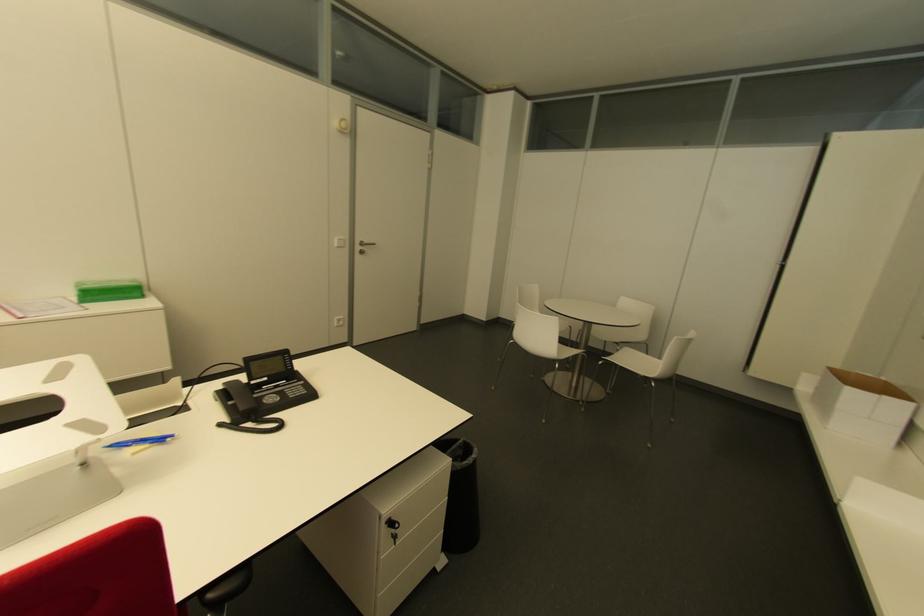
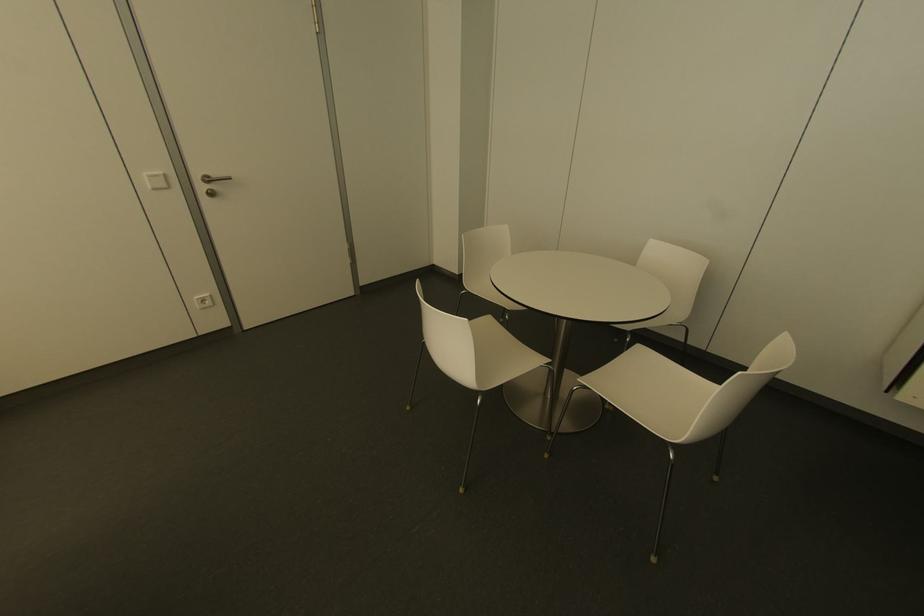
Locate, in the second image, the point that corresponds to point (581, 351) in the first image.

(546, 361)